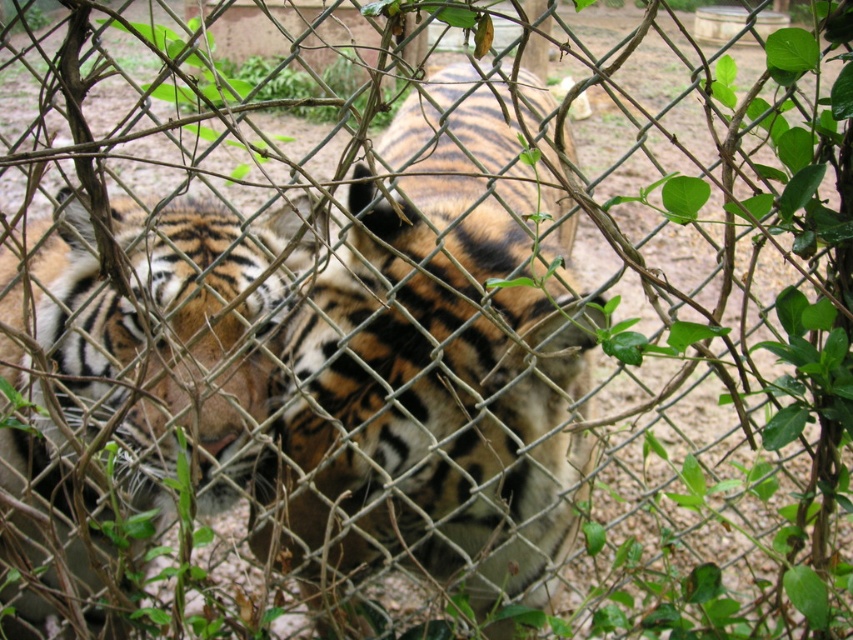
You are standing in front of the tiger enclosure and want to take a photo of the tiger behind the chain link fence. The camera you are using has a focus range of 5 feet. Is the point where the tiger is resting, point (509, 243), within the camera focus range?

The point (509, 243) is 4.20 feet from the camera, so yes, it is within the camera focus range of 5 feet.